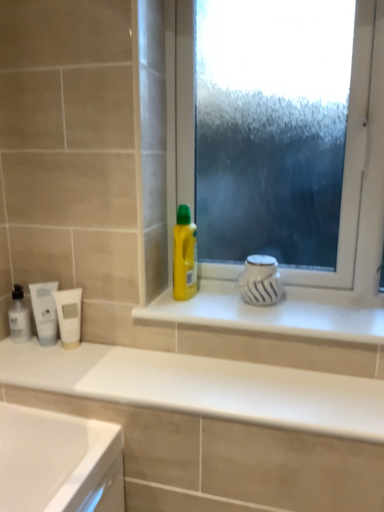
Where is `blank space above white glossy counter top at lower center (from a real-world perspective)`? blank space above white glossy counter top at lower center (from a real-world perspective) is located at coordinates 167,372.